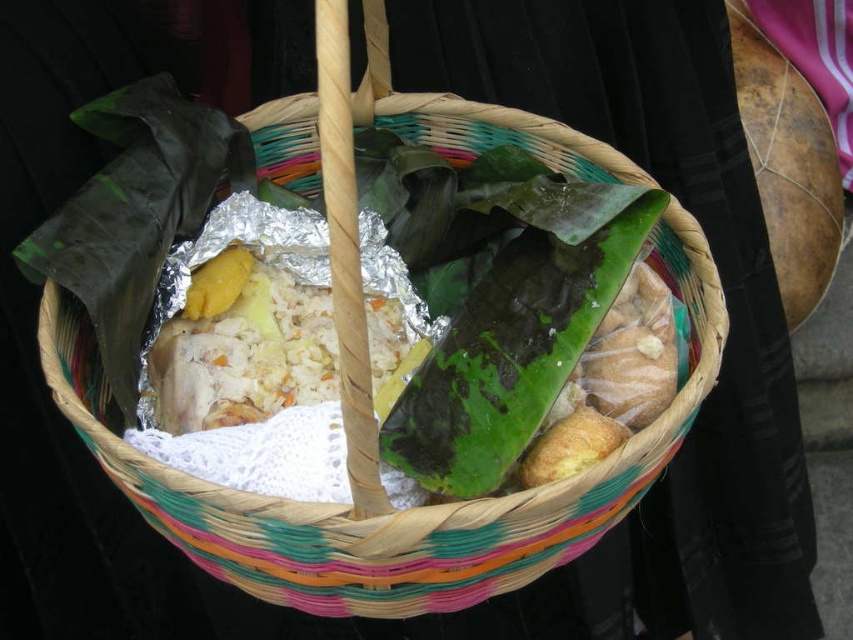
You are at a market and see the woven basket with food items. You want to reach the white rice at center without moving the green matte banana leaf at center. Is this possible?

The green matte banana leaf at center is located above the white rice at center, so you cannot reach the white rice at center without moving the green matte banana leaf at center.

You are a chef preparing to serve a meal from the basket. You need to grab the green matte banana leaf at center and the white rice at center. How far apart are these two items?

The green matte banana leaf at center and white rice at center are 16.41 centimeters apart.

You are looking at the basket and want to find the green matte banana leaf at center. Where exactly is it located in the basket?

The green matte banana leaf at center is located at point (509,320) in the basket.